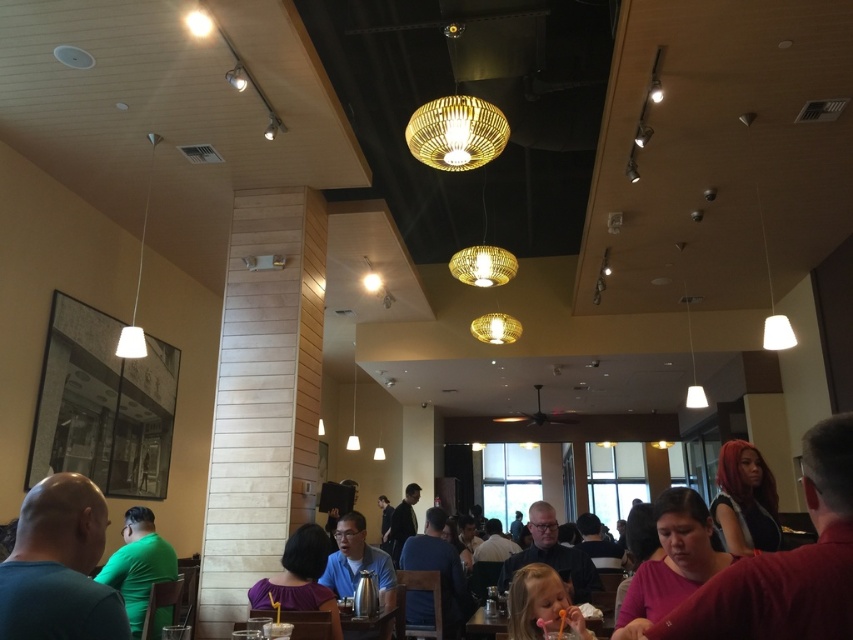
Question: Can you confirm if dark blue shirt at left is positioned below green matte shirt at left?

Choices:
 (A) yes
 (B) no

Answer: (B)

Question: Which of the following is the closest to the observer?

Choices:
 (A) (57, 548)
 (B) (283, 589)
 (C) (564, 598)

Answer: (A)

Question: Is matte pink shirt at lower right smaller than green matte shirt at left?

Choices:
 (A) yes
 (B) no

Answer: (B)

Question: Which point appears farthest from the camera in this image?

Choices:
 (A) (335, 637)
 (B) (497, 116)
 (C) (490, 630)
 (D) (521, 637)

Answer: (B)

Question: Can you confirm if shiny red hair at lower right is wider than clear plastic cup at lower center?

Choices:
 (A) no
 (B) yes

Answer: (B)

Question: Which object appears farthest from the camera in this image?

Choices:
 (A) dark blue shirt at left
 (B) clear plastic cup at lower center

Answer: (B)